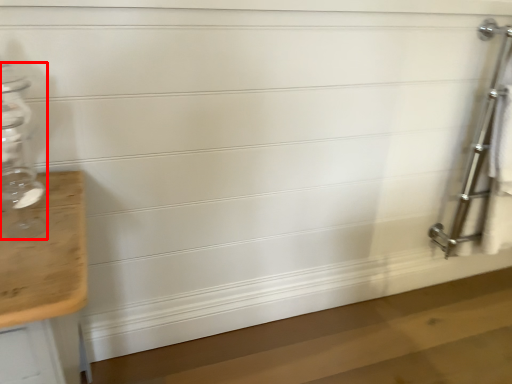
Question: Considering the relative positions of glass bottle (annotated by the red box) and ladder in the image provided, where is glass bottle (annotated by the red box) located with respect to the staircase?

Choices:
 (A) right
 (B) left

Answer: (B)